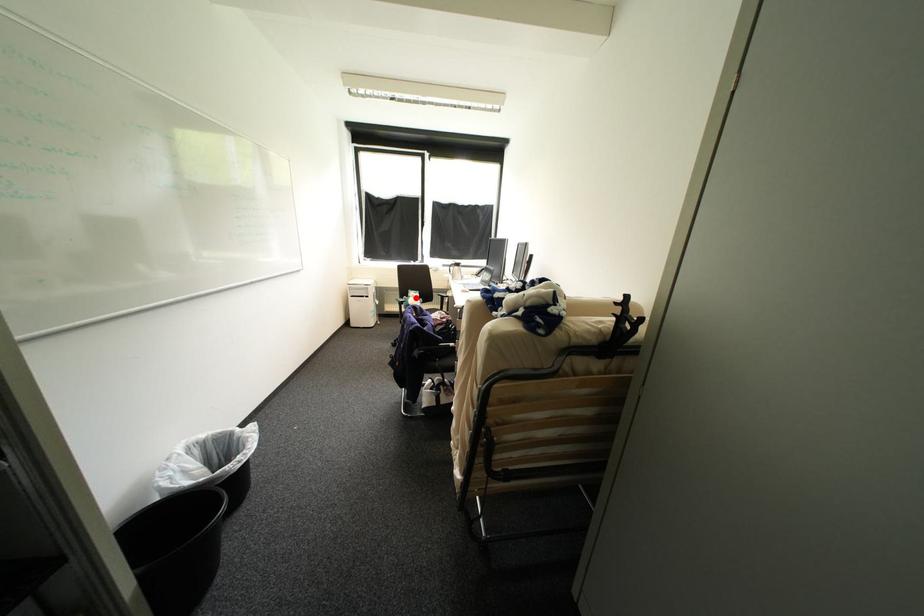
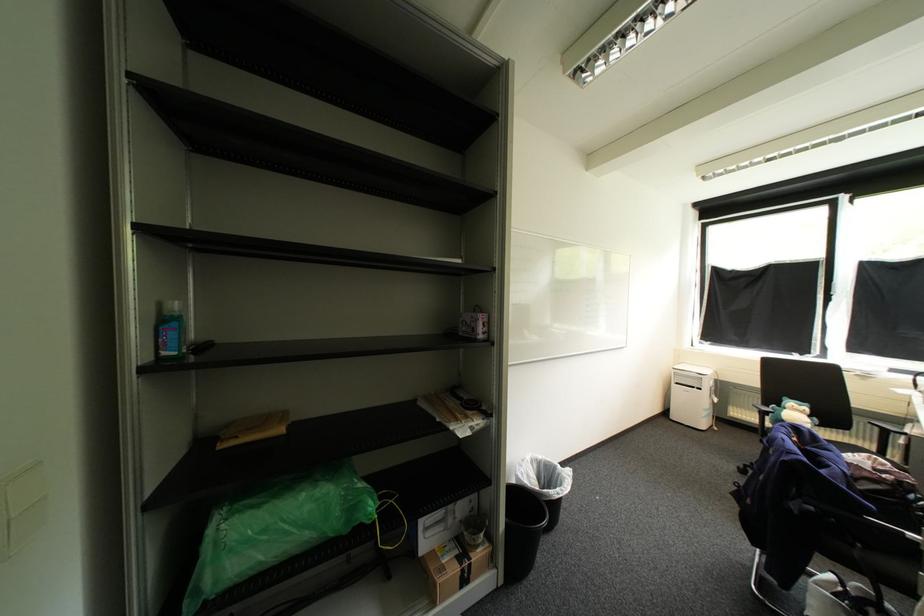
Question: I am providing you with two images of the same scene from different viewpoints. A red point is marked on the first image. At the location where the point appears in image 1, is it still visible in image 2?

Choices:
 (A) Yes
 (B) No

Answer: (A)